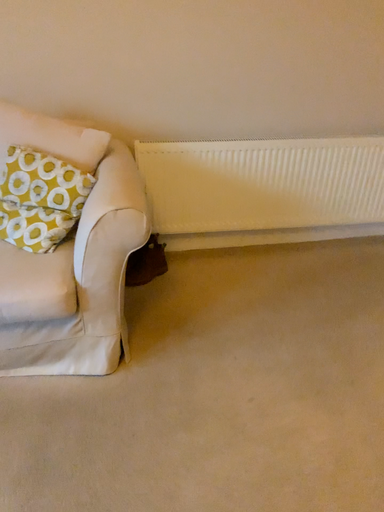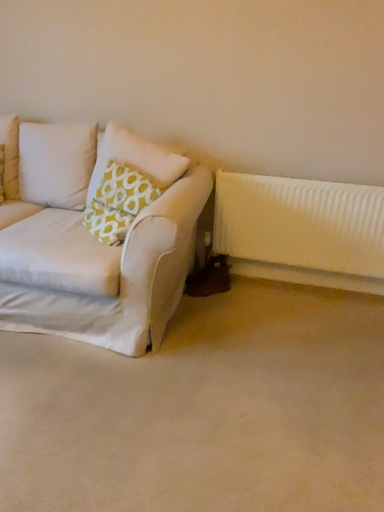
Question: How did the camera likely rotate when shooting the video?

Choices:
 (A) rotated right
 (B) rotated left

Answer: (B)